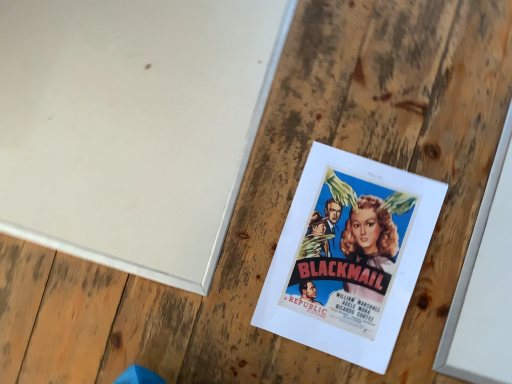
Question: From the image's perspective, would you say white matte bulletin board at upper left is positioned over matte paper poster at center?

Choices:
 (A) no
 (B) yes

Answer: (B)

Question: From the image's perspective, is white matte bulletin board at upper left under matte paper poster at center?

Choices:
 (A) no
 (B) yes

Answer: (A)

Question: Is white matte bulletin board at upper left thinner than matte paper poster at center?

Choices:
 (A) yes
 (B) no

Answer: (B)

Question: Does white matte bulletin board at upper left come behind matte paper poster at center?

Choices:
 (A) no
 (B) yes

Answer: (B)

Question: Is white matte bulletin board at upper left to the right of matte paper poster at center from the viewer's perspective?

Choices:
 (A) no
 (B) yes

Answer: (A)

Question: Is white matte bulletin board at upper left wider than matte paper poster at center?

Choices:
 (A) yes
 (B) no

Answer: (A)

Question: Considering the relative sizes of matte paper poster at center and white matte bulletin board at upper left in the image provided, is matte paper poster at center smaller than white matte bulletin board at upper left?

Choices:
 (A) yes
 (B) no

Answer: (A)

Question: Can you confirm if matte paper poster at center is taller than white matte bulletin board at upper left?

Choices:
 (A) no
 (B) yes

Answer: (B)

Question: From the image's perspective, is matte paper poster at center beneath white matte bulletin board at upper left?

Choices:
 (A) no
 (B) yes

Answer: (B)

Question: Considering the relative positions of matte paper poster at center and white matte bulletin board at upper left in the image provided, is matte paper poster at center to the right of white matte bulletin board at upper left from the viewer's perspective?

Choices:
 (A) no
 (B) yes

Answer: (B)

Question: Is the position of matte paper poster at center more distant than that of white matte bulletin board at upper left?

Choices:
 (A) no
 (B) yes

Answer: (A)

Question: Is matte paper poster at center to the left of white matte bulletin board at upper left from the viewer's perspective?

Choices:
 (A) no
 (B) yes

Answer: (A)

Question: Looking at the image, does matte paper poster at center seem bigger or smaller compared to white matte bulletin board at upper left?

Choices:
 (A) small
 (B) big

Answer: (A)